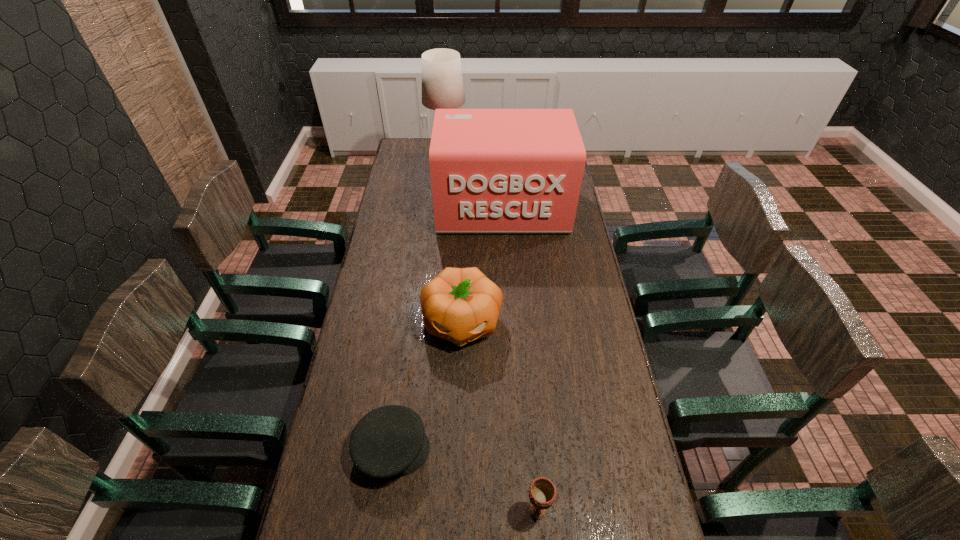
Identify the location of the tallest object. (442, 83).

Where is `the farthest object`? This screenshot has height=540, width=960. the farthest object is located at coordinates (442, 83).

This screenshot has width=960, height=540. Identify the location of box. (493, 171).

In order to click on the fourth shortest object in this screenshot , I will do `click(493, 171)`.

I want to click on the third tallest object, so coord(460,305).

Identify the location of the third farthest object. (460, 305).

You are a GUI agent. You are given a task and a screenshot of the screen. Output one action in this format:
    pyautogui.click(x=<x>, y=<y>)
    Task: Click on the chalice
    Image resolution: width=960 pixels, height=540 pixels.
    Given the screenshot: What is the action you would take?
    pyautogui.click(x=542, y=492)

At what (x,y) coordinates should I click in order to perform the action: click on the nearest object. Please return your answer as a coordinate pair (x, y). The width and height of the screenshot is (960, 540). Looking at the image, I should click on (542, 492).

Identify the location of the fourth farthest object. This screenshot has height=540, width=960. (389, 441).

Locate an element on the screen. beret is located at coordinates (389, 441).